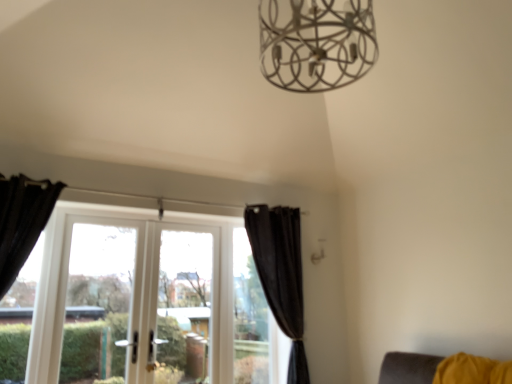
What is the approximate width of yellow fabric chair at lower right?

yellow fabric chair at lower right is 15.07 inches wide.

What do you see at coordinates (442, 369) in the screenshot?
I see `yellow fabric chair at lower right` at bounding box center [442, 369].

How much space does black velvet curtain at center, which ranks as the second curtain in left-to-right order, occupy vertically?

black velvet curtain at center, which ranks as the second curtain in left-to-right order, is 5.39 feet tall.

What is the approximate width of white glass screen door at left?

5.27 inches.

This screenshot has height=384, width=512. Identify the location of white glass window at center, the second window positioned from the right. (146, 300).

Measure the distance between black velvet curtain at left, the first curtain viewed from the left, and camera.

The distance of black velvet curtain at left, the first curtain viewed from the left, from camera is 8.95 feet.

The width and height of the screenshot is (512, 384). What do you see at coordinates (251, 320) in the screenshot?
I see `transparent glass window at center, the 1th window in the right-to-left sequence` at bounding box center [251, 320].

This screenshot has width=512, height=384. In order to click on yellow fabric chair at lower right in this screenshot , I will do `click(442, 369)`.

Is white glass window at center, the second window positioned from the right, shorter than white glass screen door at left?

Correct, white glass window at center, the second window positioned from the right, is not as tall as white glass screen door at left.

Looking at the image, does white glass window at center, the second window positioned from the right, seem bigger or smaller compared to white glass screen door at left?

white glass window at center, the second window positioned from the right, is bigger than white glass screen door at left.

Find the location of a particular element. screen door that appears behind the white glass window at center, the second window positioned from the right is located at coordinates (144, 291).

How different are the orientations of black velvet curtain at left, the first curtain when ordered from front to back, and black velvet curtain at center, which appears as the 1th curtain when viewed from the back, in degrees?

Answer: 0.000194 degrees separate the facing orientations of black velvet curtain at left, the first curtain when ordered from front to back, and black velvet curtain at center, which appears as the 1th curtain when viewed from the back.

Would you say black velvet curtain at left, the first curtain when ordered from front to back, is to the left or to the right of black velvet curtain at center, which appears as the 1th curtain when viewed from the back, in the picture?

Clearly, black velvet curtain at left, the first curtain when ordered from front to back, is on the left of black velvet curtain at center, which appears as the 1th curtain when viewed from the back, in the image.

There is a black velvet curtain at center, which ranks as the first curtain in right-to-left order. Identify the location of curtain above it (from a real-world perspective). The height and width of the screenshot is (384, 512). (22, 221).

Which is behind, point (38, 208) or point (278, 273)?

The point (278, 273) is farther from the camera.

Is transparent glass window at center, placed as the second window when sorted from left to right, taller or shorter than black velvet curtain at center, which is counted as the second curtain, starting from the front?

In the image, transparent glass window at center, placed as the second window when sorted from left to right, appears to be shorter than black velvet curtain at center, which is counted as the second curtain, starting from the front.

You are a GUI agent. You are given a task and a screenshot of the screen. Output one action in this format:
    pyautogui.click(x=<x>, y=<y>)
    Task: Click on the 1st window directly beneath the black velvet curtain at center, which ranks as the first curtain in right-to-left order (from a real-world perspective)
    
    Given the screenshot: What is the action you would take?
    pyautogui.click(x=251, y=320)

Which object is wider, transparent glass window at center, the 1th window in the right-to-left sequence, or black velvet curtain at center, which ranks as the second curtain in left-to-right order?

black velvet curtain at center, which ranks as the second curtain in left-to-right order, is wider.

Which is closer to the camera, (x=265, y=301) or (x=271, y=257)?

The point (x=271, y=257) is closer to the camera.

Considering the relative sizes of transparent glass window at center, the 1th window in the right-to-left sequence, and white glass screen door at left in the image provided, is transparent glass window at center, the 1th window in the right-to-left sequence, wider than white glass screen door at left?

In fact, transparent glass window at center, the 1th window in the right-to-left sequence, might be narrower than white glass screen door at left.

Is transparent glass window at center, placed as the second window when sorted from left to right, not close to white glass screen door at left?

They are positioned close to each other.

Between transparent glass window at center, the 1th window in the right-to-left sequence, and white glass screen door at left, which one is positioned behind?

transparent glass window at center, the 1th window in the right-to-left sequence, is behind.

Between transparent glass window at center, the 1th window in the right-to-left sequence, and white glass screen door at left, which one has smaller size?

transparent glass window at center, the 1th window in the right-to-left sequence.

Based on their positions, is yellow fabric chair at lower right located to the left or right of transparent glass window at center, the 1th window in the right-to-left sequence?

Clearly, yellow fabric chair at lower right is on the right of transparent glass window at center, the 1th window in the right-to-left sequence, in the image.

Who is taller, yellow fabric chair at lower right or transparent glass window at center, placed as the second window when sorted from left to right?

Standing taller between the two is transparent glass window at center, placed as the second window when sorted from left to right.

Is the depth of yellow fabric chair at lower right greater than that of transparent glass window at center, the 1th window in the right-to-left sequence?

No, the depth of yellow fabric chair at lower right is less than that of transparent glass window at center, the 1th window in the right-to-left sequence.

Based on their sizes in the image, would you say yellow fabric chair at lower right is bigger or smaller than transparent glass window at center, the 1th window in the right-to-left sequence?

yellow fabric chair at lower right is bigger than transparent glass window at center, the 1th window in the right-to-left sequence.

Between white glass window at center, the first window viewed from the left, and transparent glass window at center, which one has larger size?

With larger size is white glass window at center, the first window viewed from the left.

Could you measure the distance between white glass window at center, the first window viewed from the left, and transparent glass window at center?

white glass window at center, the first window viewed from the left, and transparent glass window at center are 9.05 inches apart.

Which object is further away from the camera, white glass window at center, the first window viewed from the left, or transparent glass window at center?

transparent glass window at center is behind.

Visually, is white glass window at center, the first window viewed from the left, positioned to the left or to the right of transparent glass window at center?

Clearly, white glass window at center, the first window viewed from the left, is on the left of transparent glass window at center in the image.

From the picture: Between transparent glass window at center, placed as the second window when sorted from left to right, and yellow fabric chair at lower right, which one is positioned in front?

Positioned in front is yellow fabric chair at lower right.

Between transparent glass window at center, placed as the second window when sorted from left to right, and yellow fabric chair at lower right, which one has larger size?

yellow fabric chair at lower right is bigger.

Is transparent glass window at center, the 1th window in the right-to-left sequence, thinner than yellow fabric chair at lower right?

Yes.

Locate an element on the screen. screen door that is above the white glass window at center, the second window positioned from the right (from the image's perspective) is located at coordinates (144, 291).

Find the location of a particular element. The height and width of the screenshot is (384, 512). curtain positioned vertically above the black velvet curtain at center, which ranks as the first curtain in right-to-left order (from a real-world perspective) is located at coordinates (22, 221).

Estimate the real-world distances between objects in this image. Which object is closer to white glass screen door at left, transparent glass window at center or black velvet curtain at left, acting as the 2th curtain starting from the right?

The object closer to white glass screen door at left is transparent glass window at center.

From the image, which object appears to be nearer to transparent glass window at center, the 1th window in the right-to-left sequence, black velvet curtain at center, which is counted as the second curtain, starting from the front, or white glass window at center, the second window positioned from the right?

Based on the image, black velvet curtain at center, which is counted as the second curtain, starting from the front, appears to be nearer to transparent glass window at center, the 1th window in the right-to-left sequence.

Estimate the real-world distances between objects in this image. Which object is closer to transparent glass window at center, black velvet curtain at center, which appears as the 1th curtain when viewed from the back, or black velvet curtain at left, which is the second curtain from back to front?

black velvet curtain at center, which appears as the 1th curtain when viewed from the back, is closer to transparent glass window at center.

Estimate the real-world distances between objects in this image. Which object is closer to white glass window at center, the second window positioned from the right, black velvet curtain at center, which ranks as the second curtain in left-to-right order, or yellow fabric chair at lower right?

Based on the image, black velvet curtain at center, which ranks as the second curtain in left-to-right order, appears to be nearer to white glass window at center, the second window positioned from the right.

Looking at the image, which one is located closer to white glass window at center, the second window positioned from the right, white glass screen door at left or black velvet curtain at left, acting as the 2th curtain starting from the right?

white glass screen door at left is closer to white glass window at center, the second window positioned from the right.

When comparing their distances from white glass screen door at left, does transparent glass window at center or transparent glass window at center, the 1th window in the right-to-left sequence, seem closer?

transparent glass window at center is positioned closer to the anchor white glass screen door at left.

Based on their spatial positions, is black velvet curtain at left, the first curtain when ordered from front to back, or transparent glass window at center, placed as the second window when sorted from left to right, closer to white glass screen door at left?

transparent glass window at center, placed as the second window when sorted from left to right, is positioned closer to the anchor white glass screen door at left.

When comparing their distances from white glass screen door at left, does transparent glass window at center, placed as the second window when sorted from left to right, or transparent glass window at center seem further?

transparent glass window at center, placed as the second window when sorted from left to right.

Where is `window screen between black velvet curtain at left, acting as the 2th curtain starting from the right, and transparent glass window at center, placed as the second window when sorted from left to right, from left to right`? The height and width of the screenshot is (384, 512). window screen between black velvet curtain at left, acting as the 2th curtain starting from the right, and transparent glass window at center, placed as the second window when sorted from left to right, from left to right is located at coordinates (185, 301).

At what (x,y) coordinates should I click in order to perform the action: click on window located between transparent glass window at center and black velvet curtain at center, which ranks as the first curtain in right-to-left order, in the left-right direction. Please return your answer as a coordinate pair (x, y). This screenshot has width=512, height=384. Looking at the image, I should click on (251, 320).

Where is `curtain situated between white glass window at center, the second window positioned from the right, and yellow fabric chair at lower right from left to right`? curtain situated between white glass window at center, the second window positioned from the right, and yellow fabric chair at lower right from left to right is located at coordinates (281, 274).

The height and width of the screenshot is (384, 512). Find the location of `curtain located between black velvet curtain at left, acting as the 2th curtain starting from the right, and yellow fabric chair at lower right in the left-right direction`. curtain located between black velvet curtain at left, acting as the 2th curtain starting from the right, and yellow fabric chair at lower right in the left-right direction is located at coordinates (281, 274).